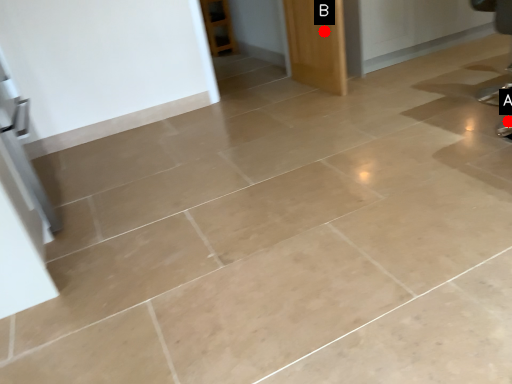
Question: Two points are circled on the image, labeled by A and B beside each circle. Among these points, which one is nearest to the camera?

Choices:
 (A) A is closer
 (B) B is closer

Answer: (A)